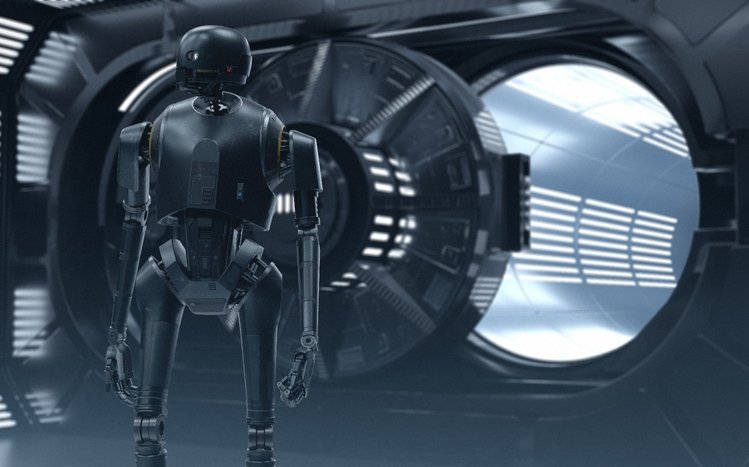
Find the location of a particular element. door is located at coordinates (431, 287).